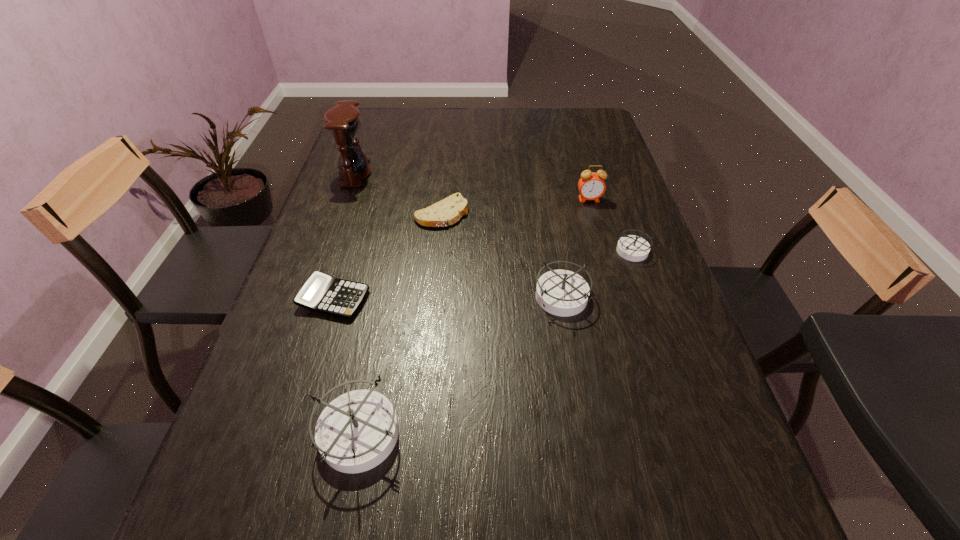
Identify the location of object identified as the second closest to the alarm clock. (564, 293).

At what (x,y) coordinates should I click in order to perform the action: click on the second closest compass relative to the nearest compass. Please return your answer as a coordinate pair (x, y). This screenshot has height=540, width=960. Looking at the image, I should click on (634, 248).

Identify which compass is the second nearest to the rightmost compass. Please provide its 2D coordinates. Your answer should be formatted as a tuple, i.e. [(x, y)], where the tuple contains the x and y coordinates of a point satisfying the conditions above.

[(357, 431)]

Identify the location of free point that satisfies the following two spatial constraints: 1. on the front side of the shortest object; 2. on the left side of the second tallest compass. (434, 298).